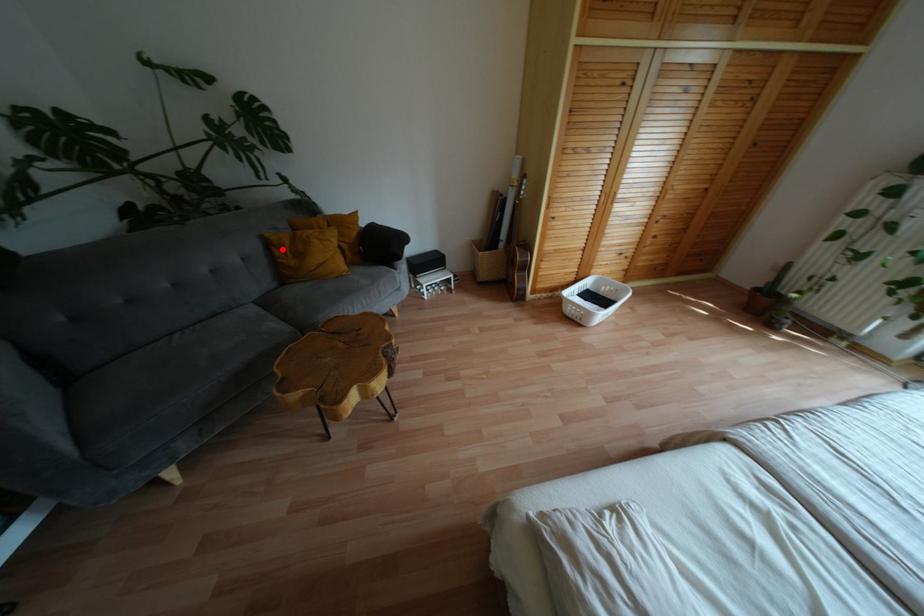
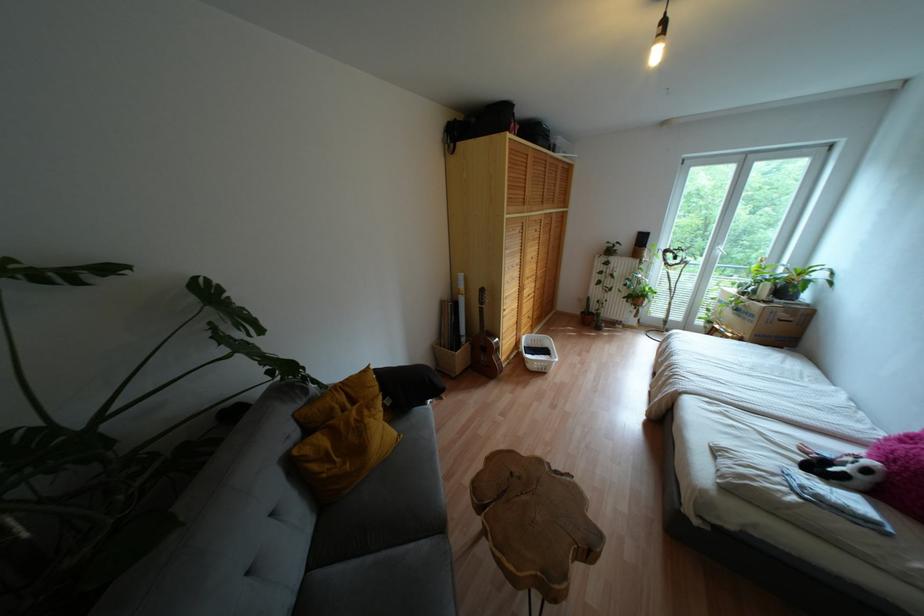
Where in the second image is the point corresponding to the highlighted location from the first image?

(325, 458)